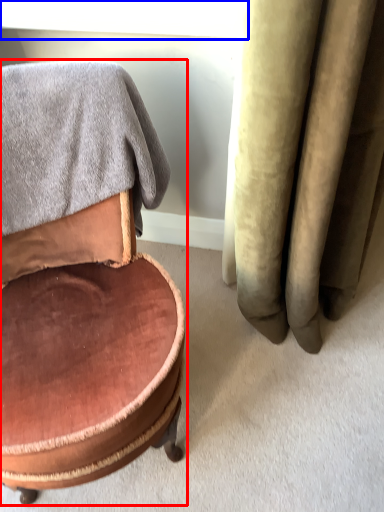
Question: Which object is further to the camera taking this photo, chair (highlighted by a red box) or window screen (highlighted by a blue box)?

Choices:
 (A) chair
 (B) window screen

Answer: (B)